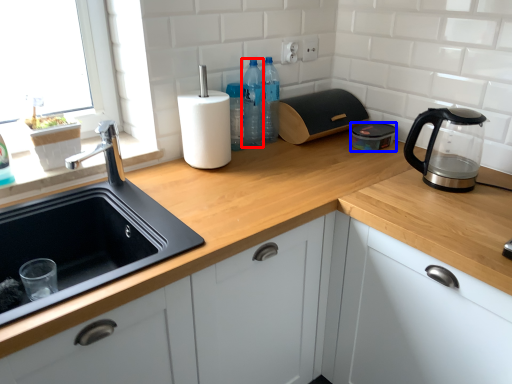
Question: Which object appears farthest to the camera in this image, bottle (highlighted by a red box) or kitchen appliance (highlighted by a blue box)?

Choices:
 (A) bottle
 (B) kitchen appliance

Answer: (B)